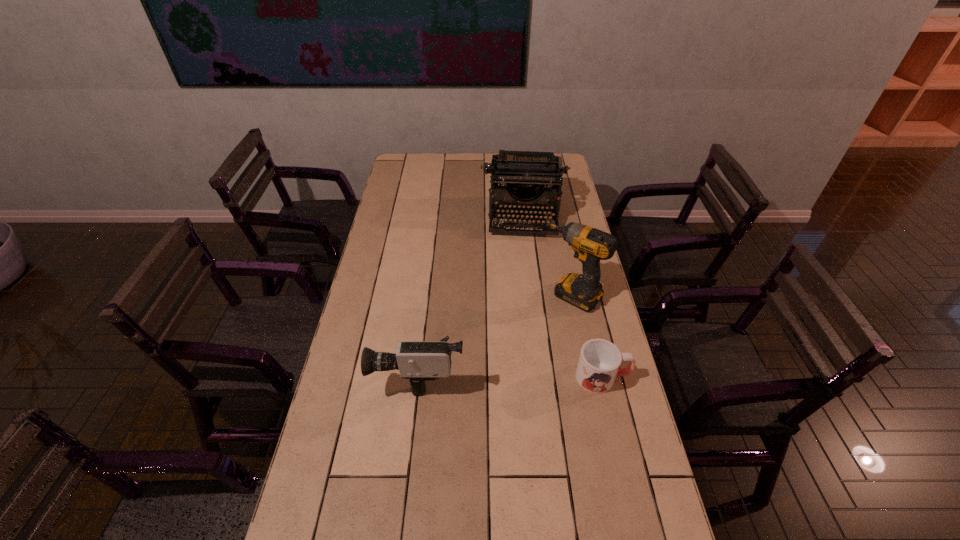
Find the location of a particular element. This screenshot has height=540, width=960. blank space at the right edge is located at coordinates (588, 427).

This screenshot has width=960, height=540. In the image, there is a desktop. Identify the location of vacant space at the far left corner. (404, 173).

Where is `vacant space at the near left corner of the desktop`? vacant space at the near left corner of the desktop is located at coordinates (306, 504).

Locate an element on the screen. free point between the camcorder and the farthest object is located at coordinates 472,294.

At what (x,y) coordinates should I click in order to perform the action: click on vacant area between the tallest object and the typewriter. Please return your answer as a coordinate pair (x, y). This screenshot has width=960, height=540. Looking at the image, I should click on pos(548,256).

The height and width of the screenshot is (540, 960). In order to click on unoccupied area between the mug and the camcorder in this screenshot , I will do `click(512, 375)`.

This screenshot has width=960, height=540. Find the location of `free space between the mug and the drill`. free space between the mug and the drill is located at coordinates (588, 336).

Where is `vacant point located between the tallest object and the farthest object`? The image size is (960, 540). vacant point located between the tallest object and the farthest object is located at coordinates (548, 256).

Image resolution: width=960 pixels, height=540 pixels. Identify the location of vacant area that lies between the drill and the shortest object. (588, 336).

Locate an element on the screen. Image resolution: width=960 pixels, height=540 pixels. free point between the second farthest object and the leftmost object is located at coordinates (496, 334).